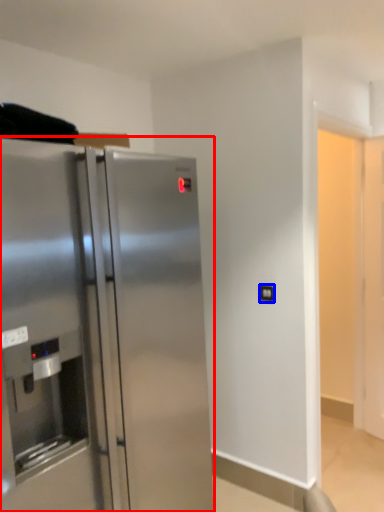
Question: Which object is further to the camera taking this photo, refrigerator (highlighted by a red box) or electric outlet (highlighted by a blue box)?

Choices:
 (A) refrigerator
 (B) electric outlet

Answer: (B)